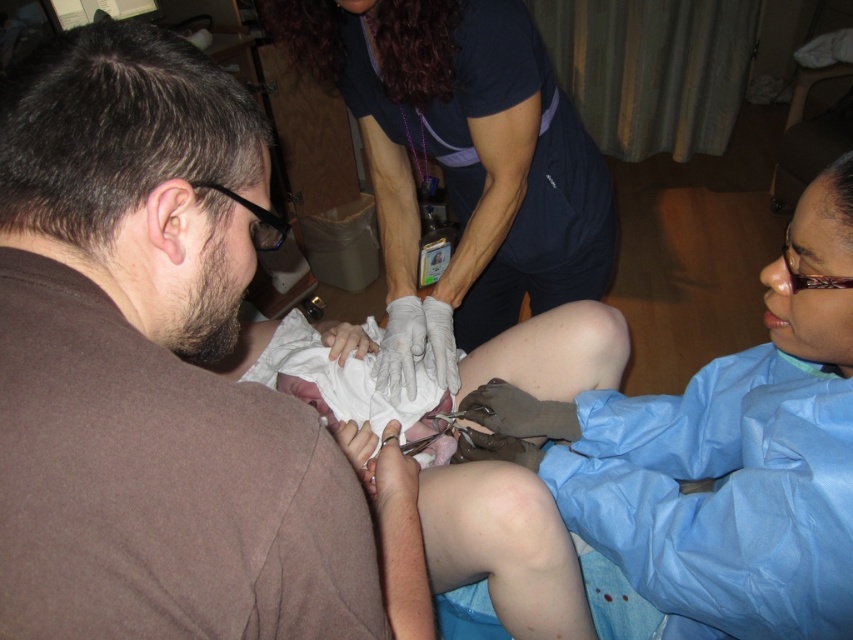
Question: Observing the image, what is the correct spatial positioning of blue latex gloves at upper center in reference to matte blue scrubs at center?

Choices:
 (A) right
 (B) left

Answer: (B)

Question: Which point appears closest to the camera in this image?

Choices:
 (A) (491, 48)
 (B) (281, 621)

Answer: (B)

Question: Does blue latex gloves at upper center appear on the left side of matte blue scrubs at center?

Choices:
 (A) yes
 (B) no

Answer: (A)

Question: Is blue latex gloves at upper center further to camera compared to matte blue scrubs at center?

Choices:
 (A) no
 (B) yes

Answer: (A)